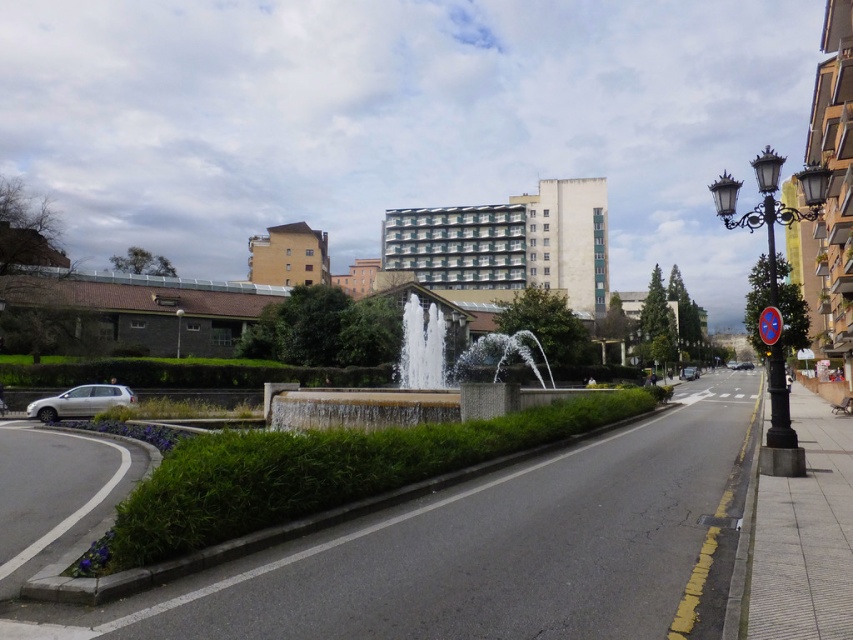
Question: Estimate the real-world distances between objects in this image. Which object is closer to the brown wooden building at right?

Choices:
 (A) white concrete building at center
 (B) shiny silver sedan at center
 (C) metallic silver car at center

Answer: (C)

Question: Can you confirm if white stone fountain at center is positioned above shiny silver sedan at center?

Choices:
 (A) yes
 (B) no

Answer: (A)

Question: Estimate the real-world distances between objects in this image. Which object is farther from the silver metallic car at left?

Choices:
 (A) shiny silver sedan at center
 (B) white concrete building at center
 (C) brown wooden building at right
 (D) white stone fountain at center

Answer: (A)

Question: Among these points, which one is nearest to the camera?

Choices:
 (A) 735,369
 (B) 264,257
 (C) 45,406
 (D) 694,378

Answer: (C)

Question: Can you confirm if silver metallic car at left is positioned above shiny silver sedan at center?

Choices:
 (A) yes
 (B) no

Answer: (A)

Question: Does white concrete building at center lie behind shiny silver sedan at center?

Choices:
 (A) yes
 (B) no

Answer: (B)